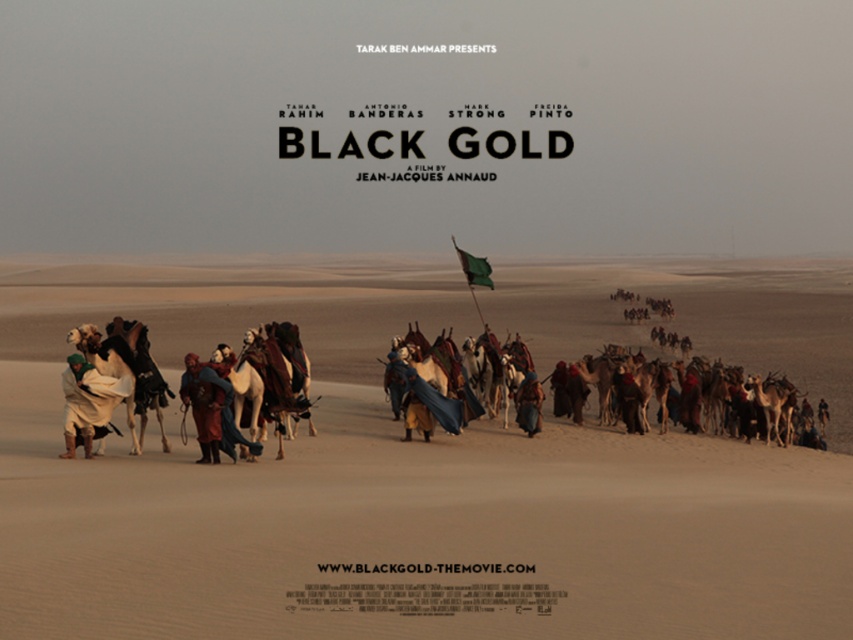
Question: Is brown textured camel at left wider than blue fabric robe at center?

Choices:
 (A) no
 (B) yes

Answer: (A)

Question: Which object is the closest to the green fabric flag at center?

Choices:
 (A) brown textured camel at left
 (B) white woolen robe at left
 (C) blue fabric robe at center
 (D) desert sand at center

Answer: (C)

Question: Is white woolen robe at left thinner than green fabric flag at center?

Choices:
 (A) yes
 (B) no

Answer: (A)

Question: Does reddish-brown leather armor at center appear on the left side of green fabric flag at center?

Choices:
 (A) yes
 (B) no

Answer: (A)

Question: Which point is farther from the camera taking this photo?

Choices:
 (A) (328, 486)
 (B) (483, 282)
 (C) (206, 454)

Answer: (B)

Question: Among these objects, which one is nearest to the camera?

Choices:
 (A) desert sand at center
 (B) brown textured camel at left

Answer: (A)